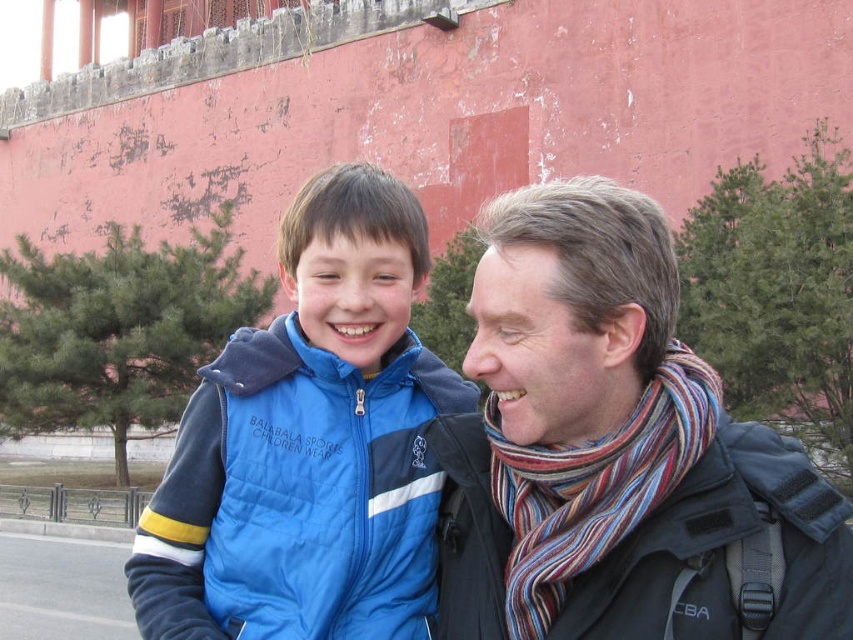
You are a photographer setting up for a group photo. You notice the striped scarf at right and the blue quilted vest at center in your frame. Based on their positions and sizes, which object should you adjust to ensure both are equally visible in the photo?

The striped scarf at right is taller than the blue quilted vest at center, so you should lower the striped scarf at right or raise the blue quilted vest at center to balance their visibility in the photo.

Based on the photo, you are a photographer trying to capture a photo of the striped scarf at right. Based on its position in the image, can you determine if it is placed closer to the top or bottom of the frame?

The striped scarf at right is located at point 0.719 on the vertical axis, which places it closer to the bottom of the frame since the coordinate is closer to 1.0 at the bottom.